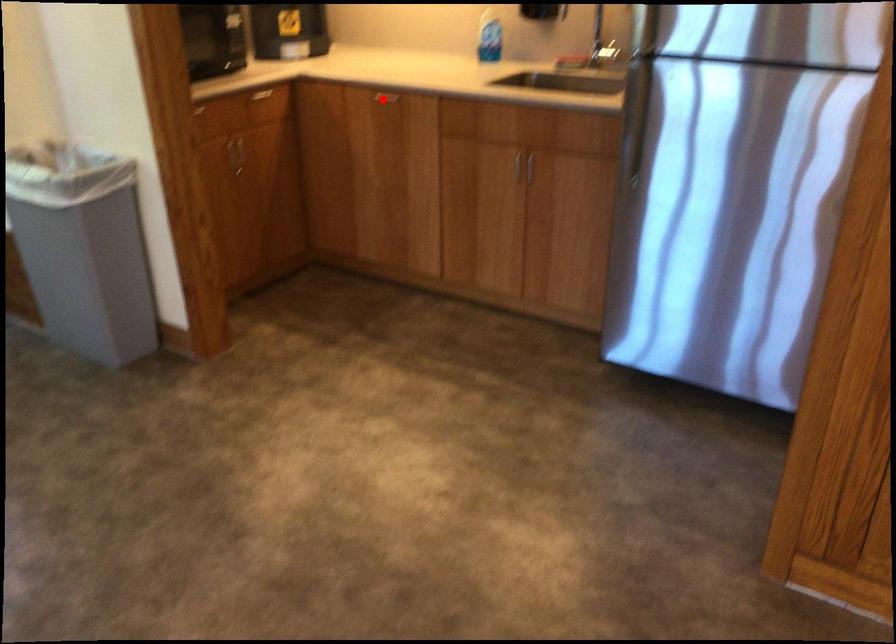
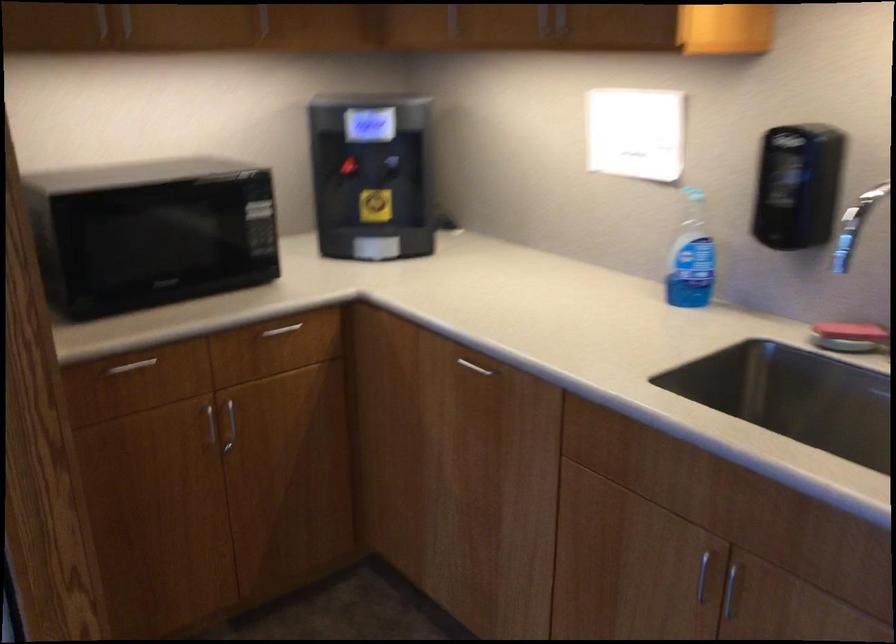
The point at the highlighted location is marked in the first image. Where is the corresponding point in the second image?

(475, 366)